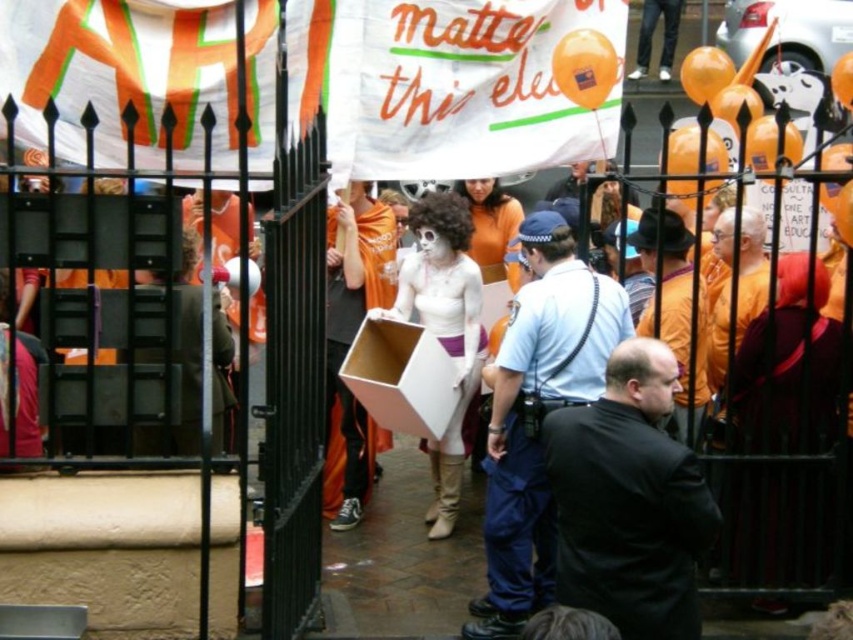
Question: Can you confirm if black matte jacket at center is smaller than orange fabric shirt at center?

Choices:
 (A) no
 (B) yes

Answer: (A)

Question: Based on their relative distances, which object is farther from the orange fabric shirt at center?

Choices:
 (A) dark blue uniform at center
 (B) black matte jacket at center

Answer: (B)

Question: Which is nearer to the orange fabric shirt at center?

Choices:
 (A) black matte jacket at center
 (B) dark blue uniform at center

Answer: (B)

Question: Among these points, which one is nearest to the camera?

Choices:
 (A) (561, 499)
 (B) (637, 320)

Answer: (A)

Question: Does dark blue uniform at center appear under orange fabric shirt at center?

Choices:
 (A) no
 (B) yes

Answer: (B)

Question: Observing the image, what is the correct spatial positioning of black matte jacket at center in reference to dark blue uniform at center?

Choices:
 (A) right
 (B) left

Answer: (A)